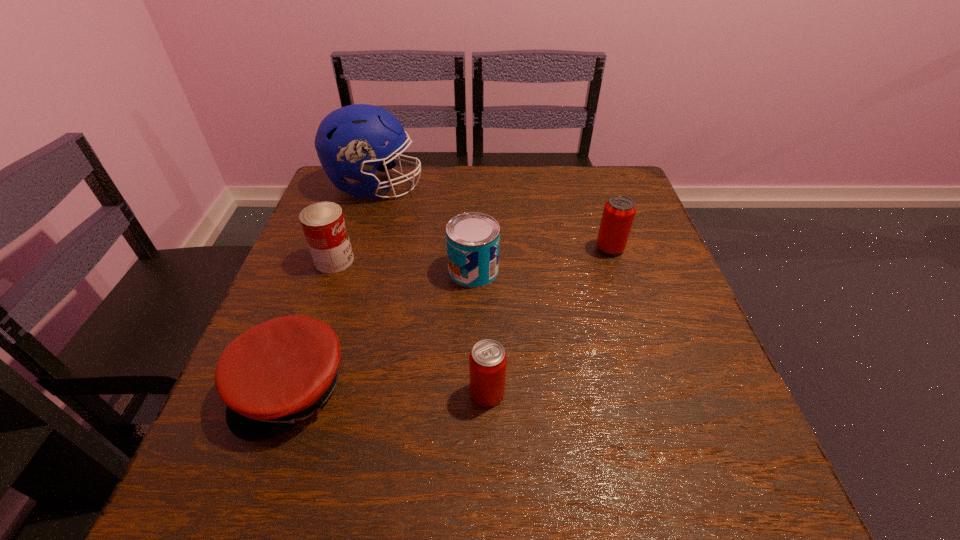
Identify the location of free point at the near left corner. (196, 491).

This screenshot has height=540, width=960. Find the location of `free location at the far right corner`. free location at the far right corner is located at coordinates (630, 190).

In the image, there is a desktop. At what (x,y) coordinates should I click in order to perform the action: click on vacant space at the near right corner. Please return your answer as a coordinate pair (x, y). The image size is (960, 540). Looking at the image, I should click on (756, 461).

I want to click on free space between the nearest can and the leftmost can, so click(411, 327).

Identify the location of free space between the nearest can and the leftmost can. (411, 327).

The width and height of the screenshot is (960, 540). What are the coordinates of `free spot between the farthest object and the cap` in the screenshot? It's located at (334, 288).

Locate an element on the screen. The image size is (960, 540). the fourth closest object to the nearest can is located at coordinates (619, 211).

Identify which object is the fifth closest to the leftmost can. Please provide its 2D coordinates. Your answer should be formatted as a tuple, i.e. [(x, y)], where the tuple contains the x and y coordinates of a point satisfying the conditions above.

[(619, 211)]

Find the location of a particular element. The image size is (960, 540). can that is the third nearest to the nearest can is located at coordinates (619, 211).

Identify the location of can that stands as the second closest to the football helmet. Image resolution: width=960 pixels, height=540 pixels. (473, 239).